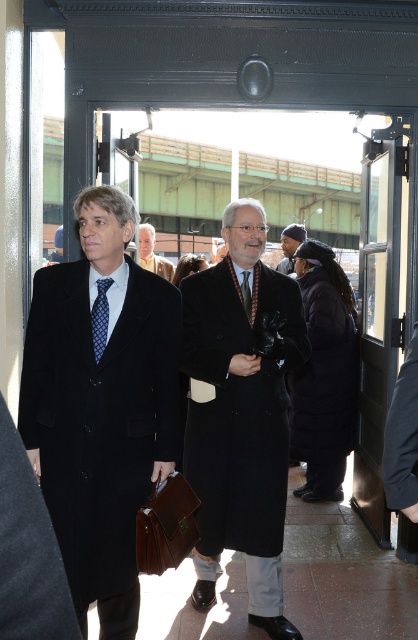
Does dark blue knit hat at center have a smaller size compared to red plaid tie at center?

No.

Between point (292, 252) and point (250, 294), which one is positioned behind?

The point (292, 252) is more distant.

Is point (293, 250) behind point (241, 284)?

Yes, it is.

This screenshot has width=418, height=640. Identify the location of dark blue knit hat at center. (290, 244).

Does matte black coat at center have a lesser height compared to black wool coat at center?

No, matte black coat at center is not shorter than black wool coat at center.

Who is higher up, matte black coat at center or black wool coat at center?

black wool coat at center

Image resolution: width=418 pixels, height=640 pixels. What do you see at coordinates (241, 413) in the screenshot?
I see `matte black coat at center` at bounding box center [241, 413].

Where is `matte black coat at center`? matte black coat at center is located at coordinates (241, 413).

Which is above, matte black coat at left or light brown leather jacket at center?

light brown leather jacket at center is above.

Does point (139, 284) lie in front of point (147, 252)?

Yes, point (139, 284) is closer to viewer.

You are a GUI agent. You are given a task and a screenshot of the screen. Output one action in this format:
    pyautogui.click(x=<x>, y=<y>)
    Task: Click on the matte black coat at left
    
    Given the screenshot: What is the action you would take?
    pyautogui.click(x=101, y=406)